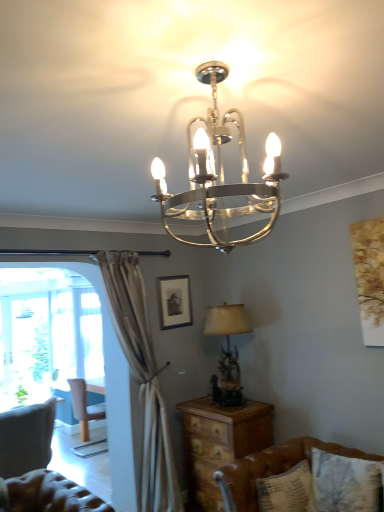
Image resolution: width=384 pixels, height=512 pixels. What do you see at coordinates (271, 469) in the screenshot? I see `brown leather couch at lower right` at bounding box center [271, 469].

This screenshot has height=512, width=384. What are the coordinates of `wooden nightstand at lower center` in the screenshot? It's located at (220, 442).

The image size is (384, 512). In order to click on tufted leather swivel chair at lower left in this screenshot , I will do `click(26, 438)`.

Describe the element at coordinates (84, 407) in the screenshot. I see `light brown wooden chair at left` at that location.

What are the coordinates of `brown leather couch at lower right` in the screenshot? It's located at (271, 469).

From a real-world perspective, who is located lower, polished metal chandelier at upper center, acting as the 2th lamp starting from the bottom, or matte black picture frame at center?

matte black picture frame at center, from a real-world perspective.

Is polished metal chandelier at upper center, acting as the 2th lamp starting from the bottom, inside or outside of matte black picture frame at center?

polished metal chandelier at upper center, acting as the 2th lamp starting from the bottom, is not enclosed by matte black picture frame at center.

Considering the sizes of objects polished metal chandelier at upper center, the 1th lamp from the top, and matte black picture frame at center in the image provided, who is shorter, polished metal chandelier at upper center, the 1th lamp from the top, or matte black picture frame at center?

Standing shorter between the two is matte black picture frame at center.

Is matte black picture frame at center surrounded by matte beige lampshade at right, placed as the 1th lamp when sorted from back to front?

No, matte beige lampshade at right, placed as the 1th lamp when sorted from back to front, does not contain matte black picture frame at center.

Looking at this image, is matte beige lampshade at right, acting as the 1th lamp starting from the bottom, positioned with its back to matte black picture frame at center?

No, matte black picture frame at center is not at the back of matte beige lampshade at right, acting as the 1th lamp starting from the bottom.

Is matte beige lampshade at right, which is the 2th lamp from top to bottom, smaller than matte black picture frame at center?

No, matte beige lampshade at right, which is the 2th lamp from top to bottom, is not smaller than matte black picture frame at center.

Which of these two, matte black picture frame at center or light brown wooden chair at left, is wider?

light brown wooden chair at left.

From the picture: Is light brown wooden chair at left at the back of matte black picture frame at center?

matte black picture frame at center is not turned away from light brown wooden chair at left.

Is the position of matte black picture frame at center less distant than that of light brown wooden chair at left?

Yes.

Does point (165, 314) come closer to viewer compared to point (78, 404)?

Yes, it is in front of point (78, 404).

Relative to polished metal chandelier at upper center, acting as the 2th lamp starting from the bottom, is patterned fabric pillow at lower right in front or behind?

Clearly, patterned fabric pillow at lower right is behind polished metal chandelier at upper center, acting as the 2th lamp starting from the bottom.

Would you say patterned fabric pillow at lower right is to the left or to the right of polished metal chandelier at upper center, the 1th lamp from the top, in the picture?

patterned fabric pillow at lower right is positioned on polished metal chandelier at upper center, the 1th lamp from the top,'s right side.

Locate an element on the screen. The image size is (384, 512). pillow located below the polished metal chandelier at upper center, the 1th lamp from the top (from the image's perspective) is located at coordinates (287, 490).

From a real-world perspective, which is physically below, patterned fabric pillow at lower right or polished metal chandelier at upper center, positioned as the second lamp in back-to-front order?

patterned fabric pillow at lower right, from a real-world perspective.

The height and width of the screenshot is (512, 384). In order to click on pillow above the brown leather couch at lower right (from a real-world perspective) in this screenshot , I will do `click(287, 490)`.

From a real-world perspective, is patterned fabric pillow at lower right physically below brown leather couch at lower right?

No, from a real-world perspective, patterned fabric pillow at lower right is not beneath brown leather couch at lower right.

From the picture: Is patterned fabric pillow at lower right directly adjacent to brown leather couch at lower right?

They are not placed beside each other.

From the image's perspective, is patterned fabric pillow at lower right on brown leather couch at lower right?

Yes.

Measure the distance from light brown wooden chair at left to patterned fabric pillow at lower right.

3.10 meters.

Who is smaller, light brown wooden chair at left or patterned fabric pillow at lower right?

Smaller between the two is patterned fabric pillow at lower right.

Based on the photo, is light brown wooden chair at left next to patterned fabric pillow at lower right?

No, light brown wooden chair at left is not touching patterned fabric pillow at lower right.

Which object is positioned more to the right, light brown wooden chair at left or patterned fabric pillow at lower right?

Positioned to the right is patterned fabric pillow at lower right.

Can you tell me how much light brown wooden chair at left and polished metal chandelier at upper center, which is counted as the first lamp, starting from the front, differ in facing direction?

94.1 degrees.

How far apart are light brown wooden chair at left and polished metal chandelier at upper center, acting as the 2th lamp starting from the bottom?

They are 14.23 feet apart.

From the image's perspective, is light brown wooden chair at left on polished metal chandelier at upper center, which is counted as the first lamp, starting from the front?

No.

At what (x,y) coordinates should I click in order to perform the action: click on the 1st lamp counting from the right of the light brown wooden chair at left. Please return your answer as a coordinate pair (x, y). Looking at the image, I should click on click(219, 177).

You are a GUI agent. You are given a task and a screenshot of the screen. Output one action in this format:
    pyautogui.click(x=<x>, y=<y>)
    Task: Click on the lamp above the matte black picture frame at center (from the image's perspective)
    The height and width of the screenshot is (512, 384).
    Given the screenshot: What is the action you would take?
    pyautogui.click(x=219, y=177)

Where is `lamp below the matte black picture frame at center (from a real-world perspective)`? The height and width of the screenshot is (512, 384). lamp below the matte black picture frame at center (from a real-world perspective) is located at coordinates (228, 349).

When comparing their distances from brown leather couch at lower right, does matte beige lampshade at right, which is the 2th lamp from top to bottom, or wooden nightstand at lower center seem further?

matte beige lampshade at right, which is the 2th lamp from top to bottom, is positioned further to the anchor brown leather couch at lower right.

Looking at the image, which one is located closer to matte beige lampshade at right, placed as the 1th lamp when sorted from back to front, polished metal chandelier at upper center, positioned as the second lamp in back-to-front order, or matte black picture frame at center?

The object closer to matte beige lampshade at right, placed as the 1th lamp when sorted from back to front, is matte black picture frame at center.

Looking at this image, estimate the real-world distances between objects in this image. Which object is closer to matte black picture frame at center, light brown wooden chair at left or brown leather couch at lower right?

brown leather couch at lower right.

Considering their positions, is matte beige lampshade at right, acting as the 1th lamp starting from the bottom, positioned further to patterned fabric pillow at lower right than tufted leather swivel chair at lower left?

tufted leather swivel chair at lower left.

When comparing their distances from polished metal chandelier at upper center, which is counted as the first lamp, starting from the front, does patterned fabric pillow at lower right or brown leather couch at lower right seem closer?

brown leather couch at lower right is closer to polished metal chandelier at upper center, which is counted as the first lamp, starting from the front.

Which object lies nearer to the anchor point tufted leather swivel chair at lower left, light brown wooden chair at left or polished metal chandelier at upper center, acting as the 2th lamp starting from the bottom?

The object closer to tufted leather swivel chair at lower left is light brown wooden chair at left.

In the scene shown: From the image, which object appears to be farther from wooden nightstand at lower center, brown leather couch at lower right or matte black picture frame at center?

matte black picture frame at center is positioned further to the anchor wooden nightstand at lower center.

Which object lies nearer to the anchor point polished metal chandelier at upper center, the 1th lamp from the top, tufted leather swivel chair at lower left or matte black picture frame at center?

matte black picture frame at center lies closer to polished metal chandelier at upper center, the 1th lamp from the top, than the other object.

Where is `nightstand located between polished metal chandelier at upper center, acting as the 2th lamp starting from the bottom, and matte black picture frame at center in the depth direction`? This screenshot has height=512, width=384. nightstand located between polished metal chandelier at upper center, acting as the 2th lamp starting from the bottom, and matte black picture frame at center in the depth direction is located at coordinates (220, 442).

Where is `picture frame between tufted leather swivel chair at lower left and light brown wooden chair at left along the z-axis`? This screenshot has height=512, width=384. picture frame between tufted leather swivel chair at lower left and light brown wooden chair at left along the z-axis is located at coordinates (174, 301).

The height and width of the screenshot is (512, 384). I want to click on picture frame between matte beige lampshade at right, acting as the 1th lamp starting from the bottom, and light brown wooden chair at left from front to back, so click(174, 301).

Where is `picture frame between polished metal chandelier at upper center, which is counted as the first lamp, starting from the front, and light brown wooden chair at left from front to back`? The image size is (384, 512). picture frame between polished metal chandelier at upper center, which is counted as the first lamp, starting from the front, and light brown wooden chair at left from front to back is located at coordinates (174, 301).